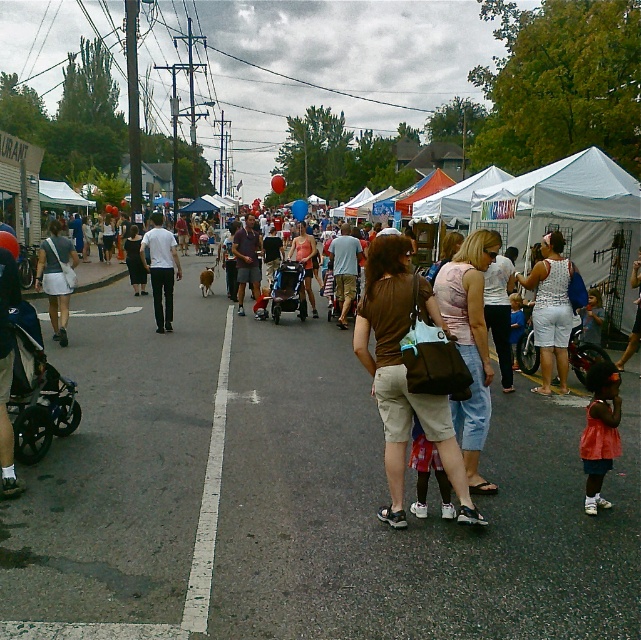
Does white denim shorts at center have a greater width compared to white cotton shirt at center?

In fact, white denim shorts at center might be narrower than white cotton shirt at center.

Identify the location of white denim shorts at center. (551, 308).

You are a GUI agent. You are given a task and a screenshot of the screen. Output one action in this format:
    pyautogui.click(x=<x>, y=<y>)
    Task: Click on the white denim shorts at center
    Image resolution: width=641 pixels, height=640 pixels.
    Given the screenshot: What is the action you would take?
    pyautogui.click(x=551, y=308)

From the picture: Which of these two, orange fabric dress at lower right or matte gray shirt at center, stands taller?

With more height is matte gray shirt at center.

Can you confirm if orange fabric dress at lower right is positioned to the right of matte gray shirt at center?

Indeed, orange fabric dress at lower right is positioned on the right side of matte gray shirt at center.

Describe the element at coordinates (599, 432) in the screenshot. I see `orange fabric dress at lower right` at that location.

Where is `orange fabric dress at lower right`? Image resolution: width=641 pixels, height=640 pixels. orange fabric dress at lower right is located at coordinates (599, 432).

Does white cotton shirt at center have a greater height compared to matte gray shirt at center?

Yes.

Is white cotton shirt at center to the right of matte gray shirt at center from the viewer's perspective?

No, white cotton shirt at center is not to the right of matte gray shirt at center.

This screenshot has height=640, width=641. I want to click on white cotton shirt at center, so coord(160,269).